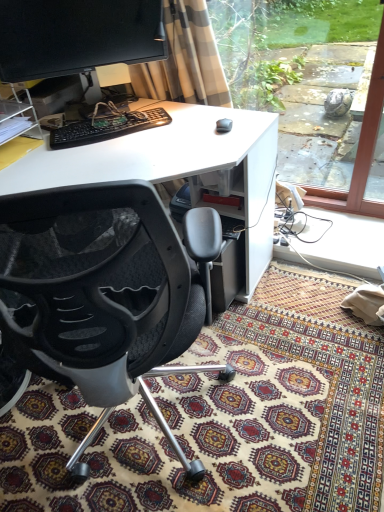
I want to click on free space to the right of black plastic keyboard at center, so click(x=184, y=130).